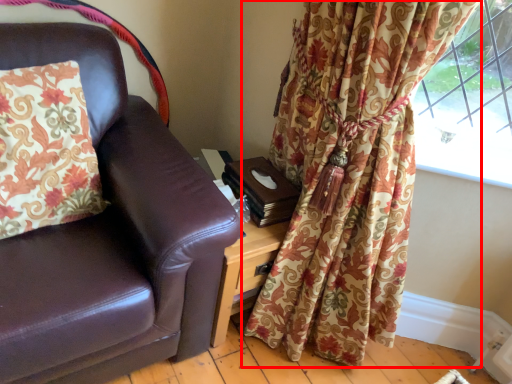
Question: Where is curtain (annotated by the red box) located in relation to pillow in the image?

Choices:
 (A) right
 (B) left

Answer: (A)